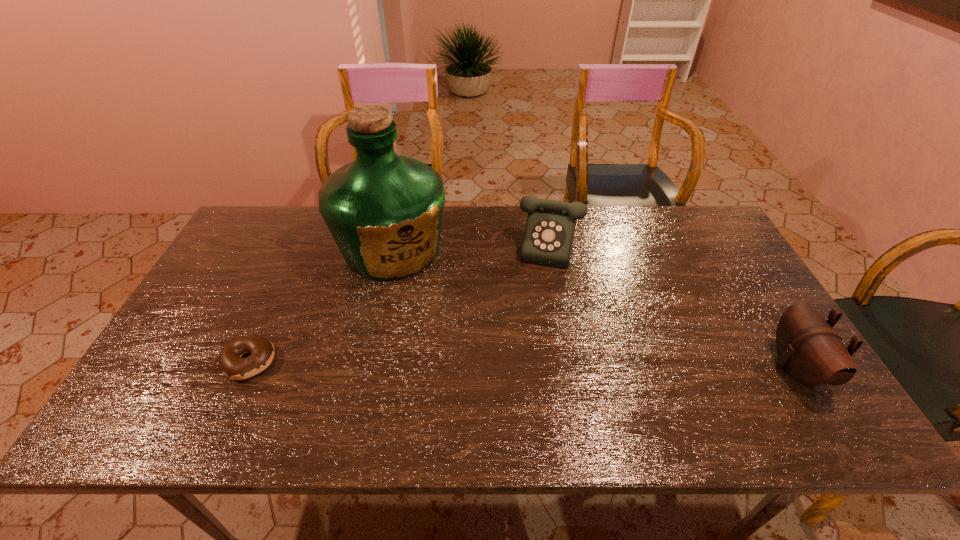
At what (x,y) coordinates should I click in order to perform the action: click on vacant space on the desktop that is between the leftmost object and the rightmost object and is positioned on the label side of the third object from right to left. Please return your answer as a coordinate pair (x, y). This screenshot has width=960, height=540. Looking at the image, I should click on (444, 363).

Locate an element on the screen. Image resolution: width=960 pixels, height=540 pixels. free spot on the desktop that is between the doughnut and the pouch and is positioned on the dial of the telephone is located at coordinates (548, 365).